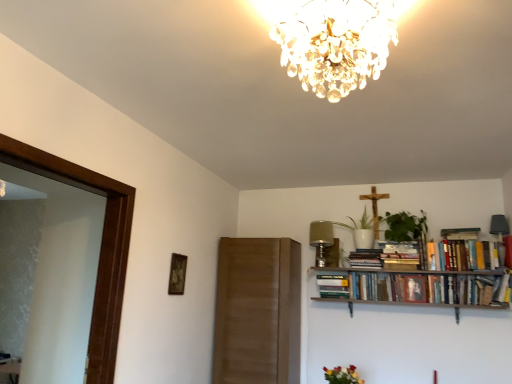
What do you see at coordinates (366, 258) in the screenshot? The width and height of the screenshot is (512, 384). I see `hardcover books at upper right, arranged as the 3th book when viewed from the right` at bounding box center [366, 258].

Where is `hardcover books at upper right, arranged as the 3th book when viewed from the right`? hardcover books at upper right, arranged as the 3th book when viewed from the right is located at coordinates (366, 258).

Measure the distance between point (494,247) and camera.

3.22 meters.

What do you see at coordinates (362, 223) in the screenshot? This screenshot has width=512, height=384. I see `white ceramic vase at upper center, the 1th plant from the left` at bounding box center [362, 223].

Find the location of a particular element. green leafy plant at upper right, the second plant viewed from the left is located at coordinates (404, 226).

The image size is (512, 384). What do you see at coordinates (428, 288) in the screenshot? I see `hardcover books at right, positioned as the 2th book in right-to-left order` at bounding box center [428, 288].

Where is `hardcover books at right, positioned as the 2th book in right-to-left order`? hardcover books at right, positioned as the 2th book in right-to-left order is located at coordinates (428, 288).

The width and height of the screenshot is (512, 384). I want to click on hardcover books at upper right, arranged as the 3th book when viewed from the right, so click(x=366, y=258).

Is hardcover books at right, the 3th book viewed from the left, positioned behind crystal glass chandelier at upper center?

Yes, the depth of hardcover books at right, the 3th book viewed from the left, is greater than that of crystal glass chandelier at upper center.

Is hardcover books at right, the 3th book viewed from the left, not near crystal glass chandelier at upper center?

That's right, there is a large distance between hardcover books at right, the 3th book viewed from the left, and crystal glass chandelier at upper center.

Between point (355, 275) and point (335, 9), which one is positioned in front?

Point (335, 9)

Is hardcover books at right, positioned as the 2th book in right-to-left order, to the left of crystal glass chandelier at upper center from the viewer's perspective?

No.

Is hardcover books at right, positioned as the 2th book in right-to-left order, next to wooden picture frame at upper left?

No, hardcover books at right, positioned as the 2th book in right-to-left order, is not next to wooden picture frame at upper left.

Is hardcover books at right, the 3th book viewed from the left, positioned with its back to wooden picture frame at upper left?

That's not correct — hardcover books at right, the 3th book viewed from the left, is not looking away from wooden picture frame at upper left.

From the image's perspective, is hardcover books at right, positioned as the 2th book in right-to-left order, over wooden picture frame at upper left?

Incorrect, from the image's perspective, hardcover books at right, positioned as the 2th book in right-to-left order, is lower than wooden picture frame at upper left.

Is wooden crucifix at upper center taller than wooden picture frame at upper left?

Correct, wooden crucifix at upper center is much taller as wooden picture frame at upper left.

Is the surface of wooden crucifix at upper center in direct contact with wooden picture frame at upper left?

They are not placed beside each other.

Is point (365, 199) positioned in front of point (175, 273)?

No, it is not.

Is wooden crucifix at upper center spatially inside wooden picture frame at upper left, or outside of it?

wooden crucifix at upper center is outside wooden picture frame at upper left.

Which object is further away from the camera, vibrant bouquet at lower center or green leafy plant at upper right, the first plant viewed from the right?

green leafy plant at upper right, the first plant viewed from the right, is further away from the camera.

Is vibrant bouquet at lower center wider or thinner than green leafy plant at upper right, the first plant viewed from the right?

Considering their sizes, vibrant bouquet at lower center looks slimmer than green leafy plant at upper right, the first plant viewed from the right.

Is green leafy plant at upper right, the second plant viewed from the left, at the back of vibrant bouquet at lower center?

vibrant bouquet at lower center is not turned away from green leafy plant at upper right, the second plant viewed from the left.

Can you confirm if vibrant bouquet at lower center is taller than green leafy plant at upper right, the first plant viewed from the right?

Incorrect, the height of vibrant bouquet at lower center is not larger of that of green leafy plant at upper right, the first plant viewed from the right.

From the image's perspective, which one is positioned lower, hardcover books at upper right, the 1th book viewed from the right, or wooden picture frame at upper left?

From the image's view, wooden picture frame at upper left is below.

Is hardcover books at upper right, acting as the fourth book starting from the left, far from wooden picture frame at upper left?

Yes, hardcover books at upper right, acting as the fourth book starting from the left, is far from wooden picture frame at upper left.

Which object is thinner, hardcover books at upper right, acting as the fourth book starting from the left, or wooden picture frame at upper left?

wooden picture frame at upper left.

Between wooden crucifix at upper center and hardcover book at upper center, the 1th book viewed from the left, which one is positioned in front?

hardcover book at upper center, the 1th book viewed from the left, is more forward.

Is point (375, 203) farther from camera compared to point (343, 277)?

Yes, it is.

From the image's perspective, is wooden crucifix at upper center positioned above or below hardcover book at upper center, positioned as the 4th book in right-to-left order?

From the image's perspective, wooden crucifix at upper center appears above hardcover book at upper center, positioned as the 4th book in right-to-left order.

Considering their positions, is wooden picture frame at upper left located in front of or behind hardcover book at upper center, positioned as the 4th book in right-to-left order?

wooden picture frame at upper left is in front of hardcover book at upper center, positioned as the 4th book in right-to-left order.

Is wooden picture frame at upper left inside or outside of hardcover book at upper center, positioned as the 4th book in right-to-left order?

wooden picture frame at upper left is not inside hardcover book at upper center, positioned as the 4th book in right-to-left order, it's outside.

Does wooden picture frame at upper left appear on the right side of hardcover book at upper center, the 1th book viewed from the left?

No.

Considering the sizes of wooden picture frame at upper left and hardcover book at upper center, the 1th book viewed from the left, in the image, is wooden picture frame at upper left bigger or smaller than hardcover book at upper center, the 1th book viewed from the left,?

Clearly, wooden picture frame at upper left is smaller in size than hardcover book at upper center, the 1th book viewed from the left.

Identify the location of lamp in front of the hardcover books at right, the 3th book viewed from the left. (336, 44).

Which book is the 1st one when counting from the back of the wooden picture frame at upper left? Please provide its 2D coordinates.

[(428, 288)]

Estimate the real-world distances between objects in this image. Which object is closer to hardcover books at right, the 3th book viewed from the left, white ceramic vase at upper center, arranged as the second plant when viewed from the right, or crystal glass chandelier at upper center?

Based on the image, white ceramic vase at upper center, arranged as the second plant when viewed from the right, appears to be nearer to hardcover books at right, the 3th book viewed from the left.

From the picture: Which object lies nearer to the anchor point hardcover books at upper right, arranged as the 3th book when viewed from the right, hardcover book at upper center, the 1th book viewed from the left, or hardcover books at upper right, acting as the fourth book starting from the left?

The object closer to hardcover books at upper right, arranged as the 3th book when viewed from the right, is hardcover book at upper center, the 1th book viewed from the left.

Which object lies nearer to the anchor point wooden picture frame at upper left, green leafy plant at upper right, the first plant viewed from the right, or wooden crucifix at upper center?

The object closer to wooden picture frame at upper left is wooden crucifix at upper center.

Estimate the real-world distances between objects in this image. Which object is closer to wooden picture frame at upper left, vibrant bouquet at lower center or hardcover books at upper right, arranged as the 3th book when viewed from the right?

vibrant bouquet at lower center is closer to wooden picture frame at upper left.

Looking at the image, which one is located further to hardcover books at right, positioned as the 2th book in right-to-left order, hardcover book at upper center, the 1th book viewed from the left, or white ceramic vase at upper center, the 1th plant from the left?

Based on the image, white ceramic vase at upper center, the 1th plant from the left, appears to be further to hardcover books at right, positioned as the 2th book in right-to-left order.

From the image, which object appears to be farther from green leafy plant at upper right, the second plant viewed from the left, hardcover books at upper right, the 2th book in the left-to-right sequence, or hardcover book at upper center, the 1th book viewed from the left?

hardcover book at upper center, the 1th book viewed from the left, lies further to green leafy plant at upper right, the second plant viewed from the left, than the other object.

Looking at the image, which one is located further to wooden crucifix at upper center, white ceramic vase at upper center, the 1th plant from the left, or vibrant bouquet at lower center?

The object further to wooden crucifix at upper center is vibrant bouquet at lower center.

Based on their spatial positions, is wooden picture frame at upper left or crystal glass chandelier at upper center further from hardcover books at right, the 3th book viewed from the left?

crystal glass chandelier at upper center lies further to hardcover books at right, the 3th book viewed from the left, than the other object.

Where is `flower between wooden picture frame at upper left and green leafy plant at upper right, the second plant viewed from the left`? This screenshot has width=512, height=384. flower between wooden picture frame at upper left and green leafy plant at upper right, the second plant viewed from the left is located at coordinates (342, 375).

The width and height of the screenshot is (512, 384). Identify the location of crucifix between wooden picture frame at upper left and hardcover books at upper right, the 1th book viewed from the right, from left to right. (375, 207).

Locate an element on the screen. crucifix between wooden picture frame at upper left and green leafy plant at upper right, the second plant viewed from the left is located at coordinates (375, 207).

Image resolution: width=512 pixels, height=384 pixels. Find the location of `flower between crystal glass chandelier at upper center and wooden picture frame at upper left from front to back`. flower between crystal glass chandelier at upper center and wooden picture frame at upper left from front to back is located at coordinates (342, 375).